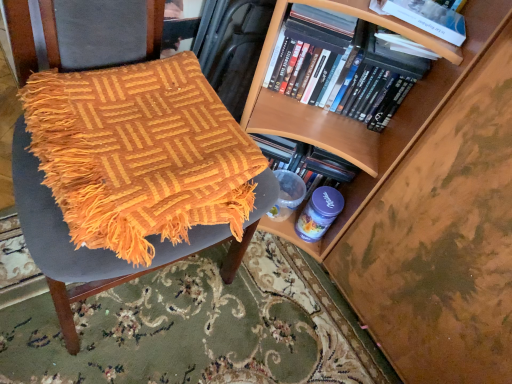
Question: Is black matte dvds at upper right, the first book positioned from the back, inside the boundaries of orange woven blanket at left, or outside?

Choices:
 (A) outside
 (B) inside

Answer: (A)

Question: Is black matte dvds at upper right, arranged as the second book when viewed from the front, taller or shorter than orange woven blanket at left?

Choices:
 (A) tall
 (B) short

Answer: (A)

Question: Which of these objects is positioned closest to the orange woven blanket at left?

Choices:
 (A) hardcover book at upper right
 (B) hardcover book at upper right, which appears as the 1th book when viewed from the front
 (C) black matte dvds at upper right, arranged as the second book when viewed from the front

Answer: (C)

Question: Considering the real-world distances, which object is closest to the black matte dvds at upper right, the first book positioned from the back?

Choices:
 (A) orange woven blanket at left
 (B) hardcover book at upper right
 (C) hardcover book at upper right, which appears as the 1th book when viewed from the front

Answer: (B)